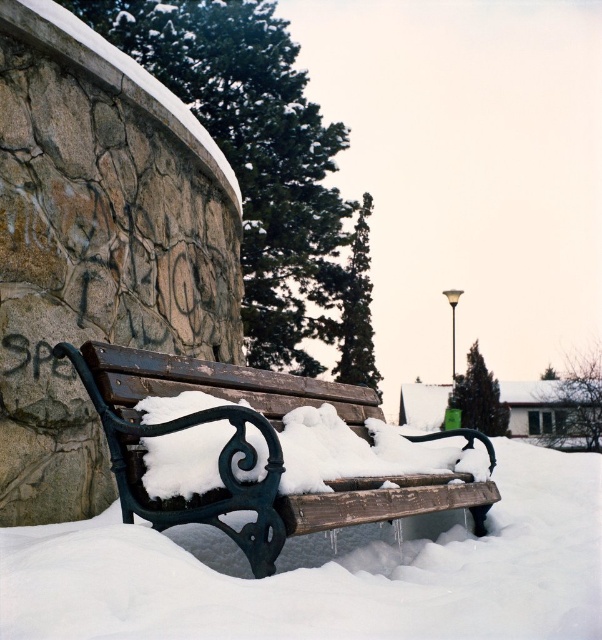
Question: Which point appears farthest from the camera in this image?

Choices:
 (A) (444, 576)
 (B) (113, 420)

Answer: (A)

Question: Is white fluffy snow at center closer to camera compared to wooden bench at center?

Choices:
 (A) yes
 (B) no

Answer: (B)

Question: Is white fluffy snow at center below wooden bench at center?

Choices:
 (A) no
 (B) yes

Answer: (B)

Question: Which point is closer to the camera taking this photo?

Choices:
 (A) (389, 518)
 (B) (476, 586)

Answer: (B)

Question: Does white fluffy snow at center appear on the left side of wooden bench at center?

Choices:
 (A) no
 (B) yes

Answer: (A)

Question: Which point appears closest to the camera in this image?

Choices:
 (A) (376, 608)
 (B) (281, 536)

Answer: (A)